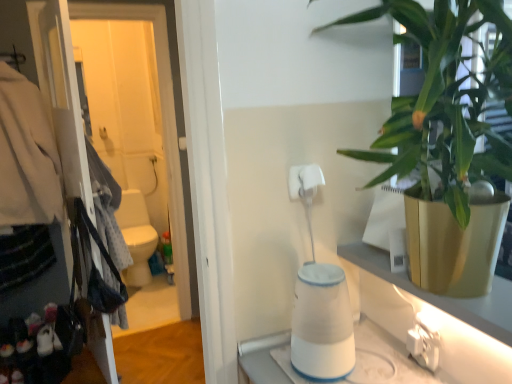
Question: From a real-world perspective, relative to white matte toilet paper at center, is white glossy screen door at left vertically above or below?

Choices:
 (A) above
 (B) below

Answer: (B)

Question: From the image's perspective, is white glossy screen door at left above or below white matte toilet paper at center?

Choices:
 (A) above
 (B) below

Answer: (A)

Question: Which is farther from the white glossy toilet at center?

Choices:
 (A) white plastic electric outlet at lower right
 (B) white glossy screen door at left
 (C) white matte toilet paper at center
 (D) green leafy plant at upper right
 (E) matte black coat hanger at left

Answer: (A)

Question: Considering the real-world distances, which object is farthest from the green leafy plant at upper right?

Choices:
 (A) white plastic electric outlet at lower right
 (B) white matte toilet paper at center
 (C) white glossy screen door at left
 (D) matte black coat hanger at left
 (E) white glossy toilet at center

Answer: (E)